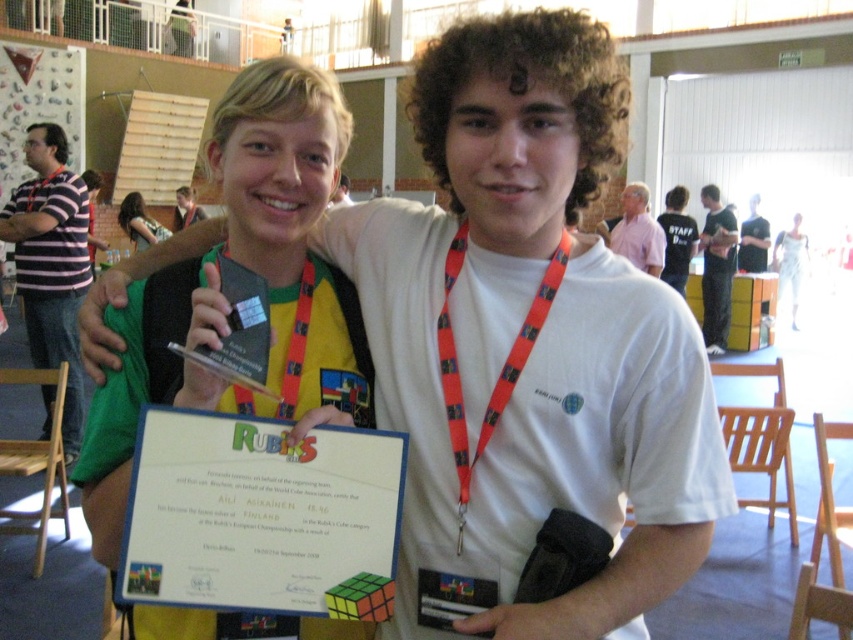
Question: Is striped cotton shirt at left positioned in front of orange fabric lanyard at center?

Choices:
 (A) no
 (B) yes

Answer: (A)

Question: Estimate the real-world distances between objects in this image. Which object is farther from the orange lanyard at center?

Choices:
 (A) orange fabric lanyard at center
 (B) striped cotton shirt at left
 (C) black fabric pants at right
 (D) pink fabric shirt at upper center

Answer: (C)

Question: Where is black fabric pants at right located in relation to pink fabric shirt at upper center in the image?

Choices:
 (A) above
 (B) below

Answer: (B)

Question: Which object is positioned farthest from the orange fabric lanyard at center?

Choices:
 (A) matte black shirt at center
 (B) orange lanyard at center
 (C) matte yellow necktie at upper center

Answer: (A)

Question: Among these points, which one is farthest from the camera?

Choices:
 (A) (51, 332)
 (B) (199, 205)
 (C) (257, 218)
 (D) (509, 104)

Answer: (B)

Question: Is striped cotton shirt at left to the right of orange lanyard at center from the viewer's perspective?

Choices:
 (A) yes
 (B) no

Answer: (B)